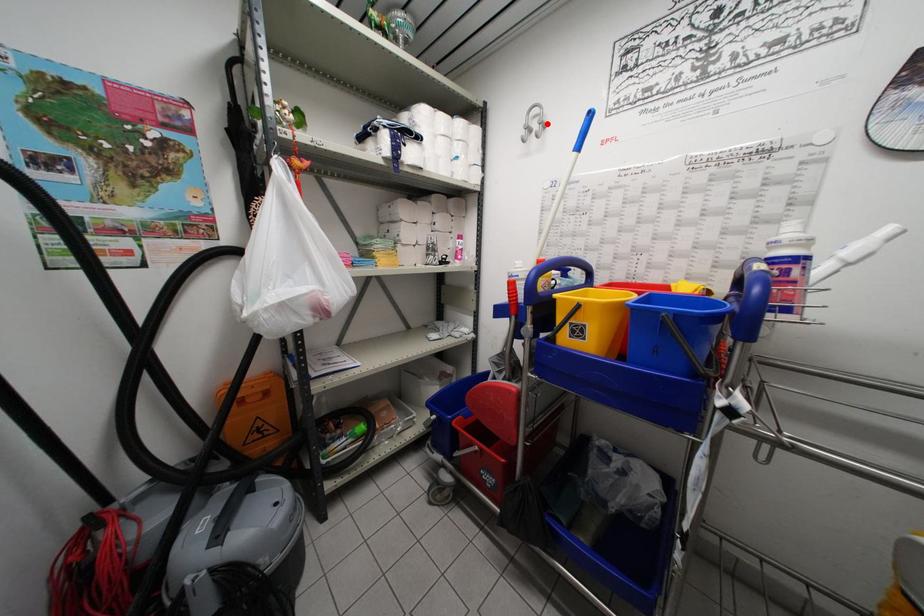
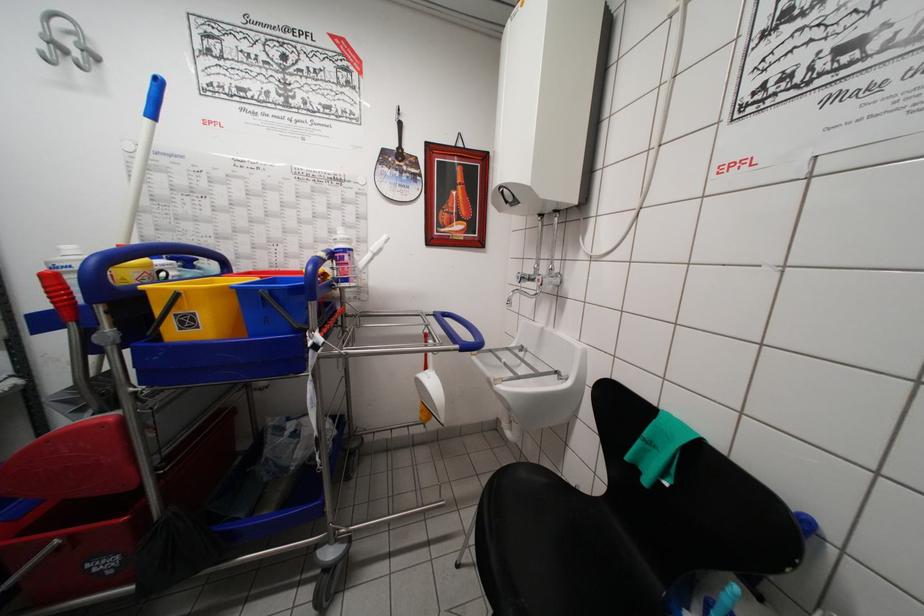
Question: I am providing you with two images of the same scene from different viewpoints. In image1, a red point is highlighted. Considering the same 3D point in image2, which of the following is correct?

Choices:
 (A) It is closer
 (B) It is farther

Answer: (B)